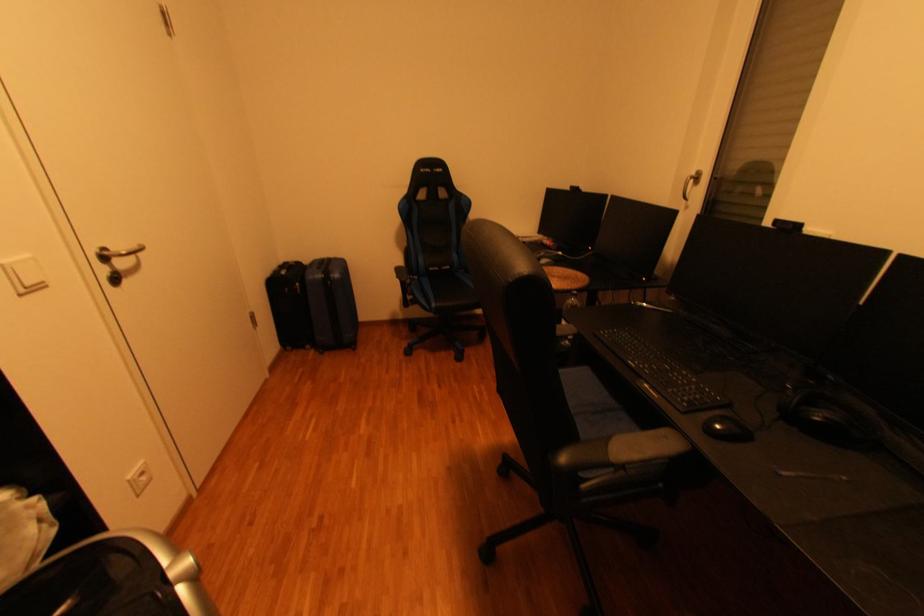
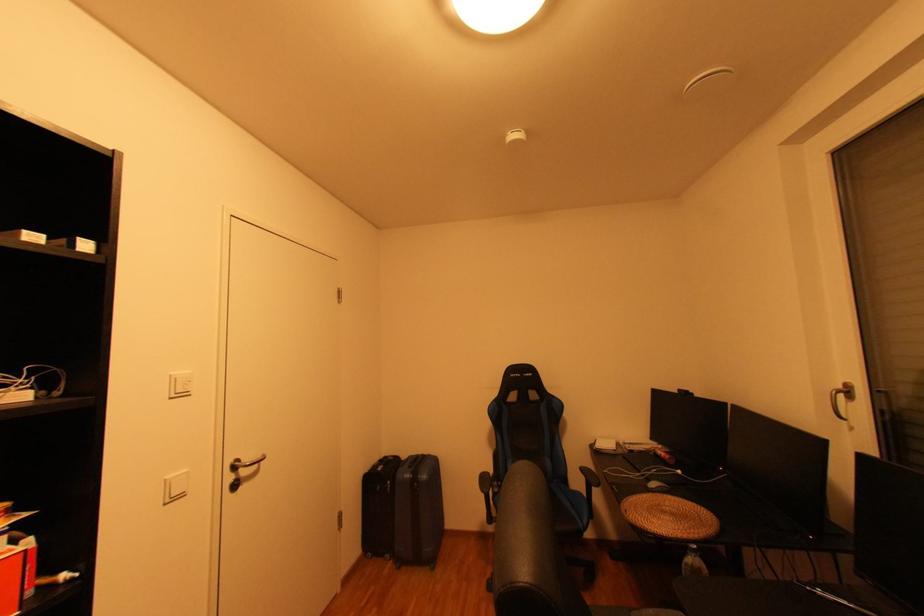
The point at (298, 347) is marked in the first image. Where is the corresponding point in the second image?

(380, 554)